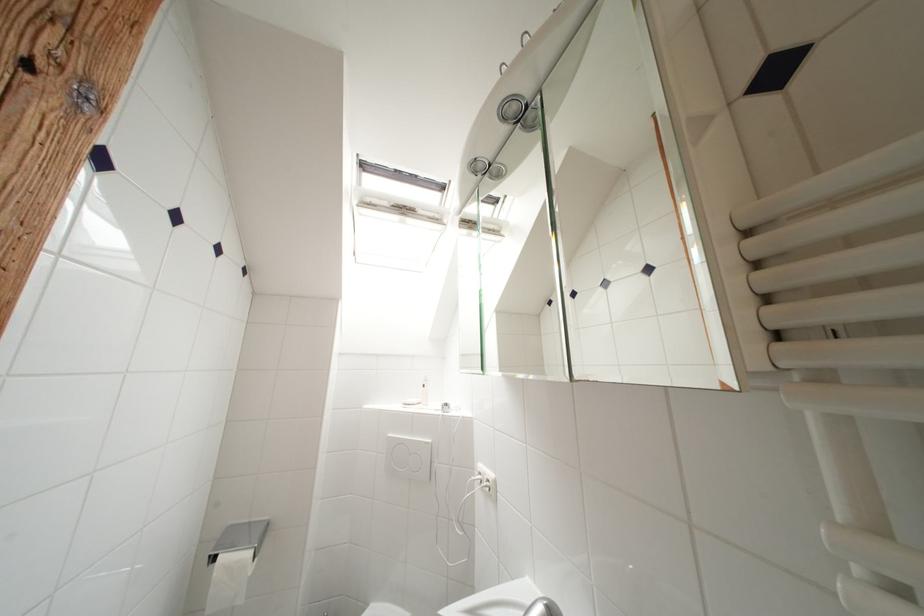
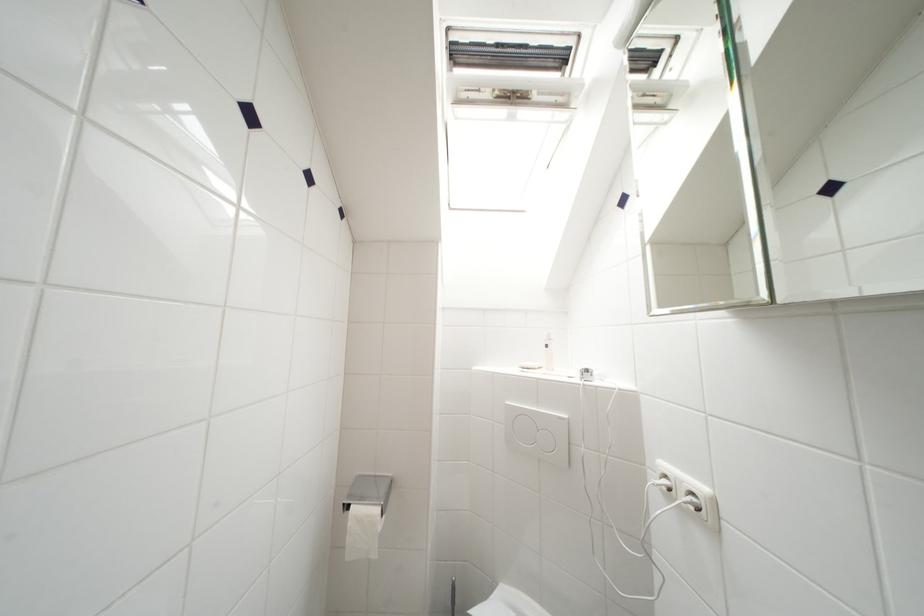
The point at (446, 198) is marked in the first image. Where is the corresponding point in the second image?

(565, 77)